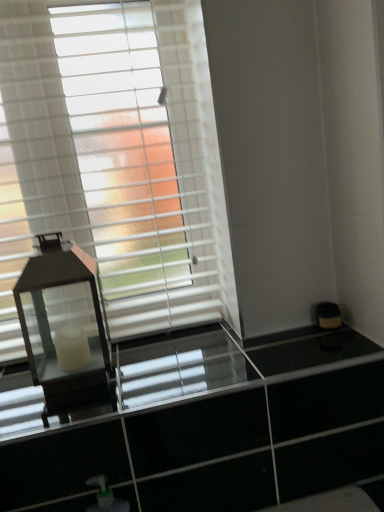
The image size is (384, 512). Identify the location of free spot above clear glass dresser at center (from a real-world perspective). (167, 358).